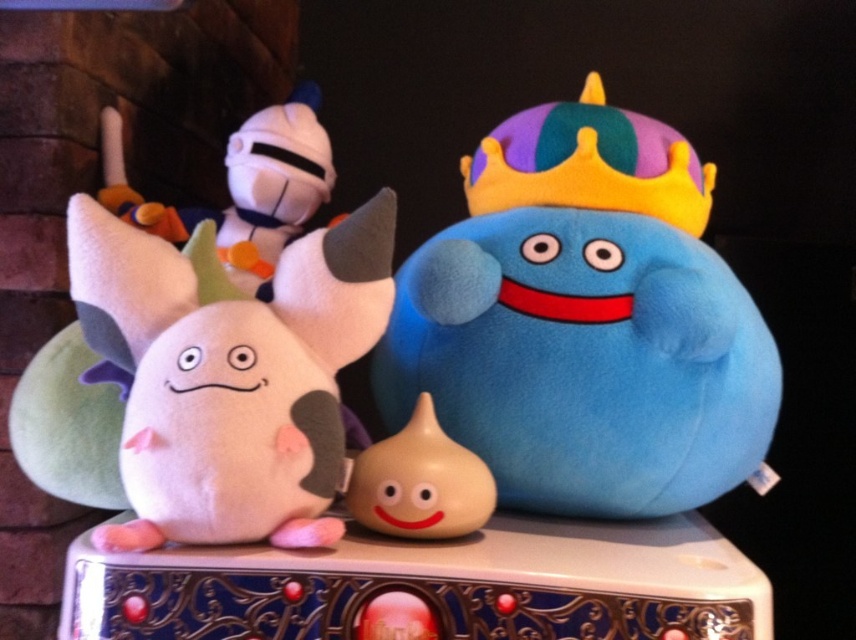
You are standing in front of the decorative surface with the blue plush toy at center and the smooth beige gourd at center. Which object is closer to you?

The blue plush toy at center is closer to you because the smooth beige gourd at center is behind it.

You are standing in front of the decorative surface with the white plush toy on the left and the blue plush toy at center. Based on their positions, which plush toy is closer to the center of the surface?

The blue plush toy at center is exactly at the center of the surface, so it is closer to the center than the white plush toy on the left.

You are organizing a display and need to know the relative heights of the blue plush toy at center and the smooth beige gourd at center. Which one is taller?

The blue plush toy at center is much taller than the smooth beige gourd at center.